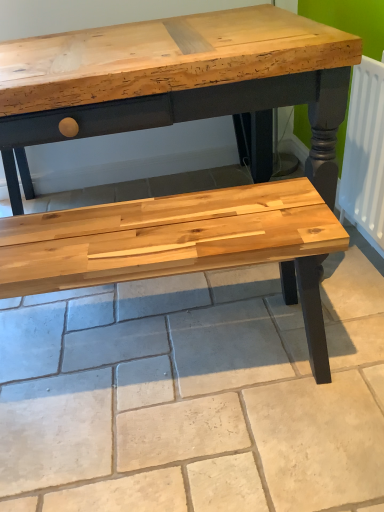
Question: From the image's perspective, relative to natural wood bench at center, is white matte radiator at right above or below?

Choices:
 (A) above
 (B) below

Answer: (A)

Question: Is white matte radiator at right wider or thinner than natural wood bench at center?

Choices:
 (A) wide
 (B) thin

Answer: (B)

Question: In terms of size, does white matte radiator at right appear bigger or smaller than natural wood bench at center?

Choices:
 (A) big
 (B) small

Answer: (B)

Question: From a real-world perspective, relative to white matte radiator at right, is natural wood bench at center vertically above or below?

Choices:
 (A) below
 (B) above

Answer: (A)

Question: In terms of size, does natural wood bench at center appear bigger or smaller than white matte radiator at right?

Choices:
 (A) big
 (B) small

Answer: (A)

Question: Is natural wood bench at center situated inside white matte radiator at right or outside?

Choices:
 (A) outside
 (B) inside

Answer: (A)

Question: In the image, is natural wood bench at center on the left side or the right side of white matte radiator at right?

Choices:
 (A) left
 (B) right

Answer: (A)